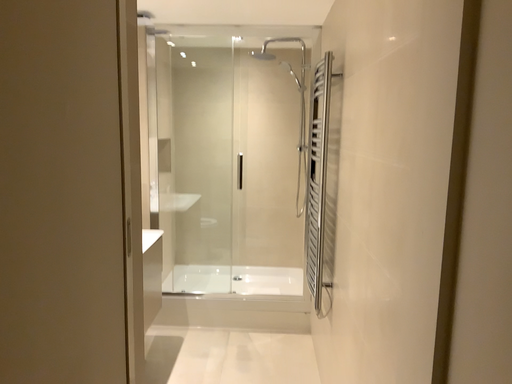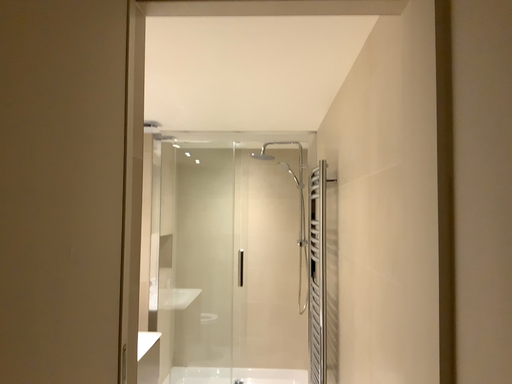
Question: Which way did the camera rotate in the video?

Choices:
 (A) rotated upward
 (B) rotated downward

Answer: (A)